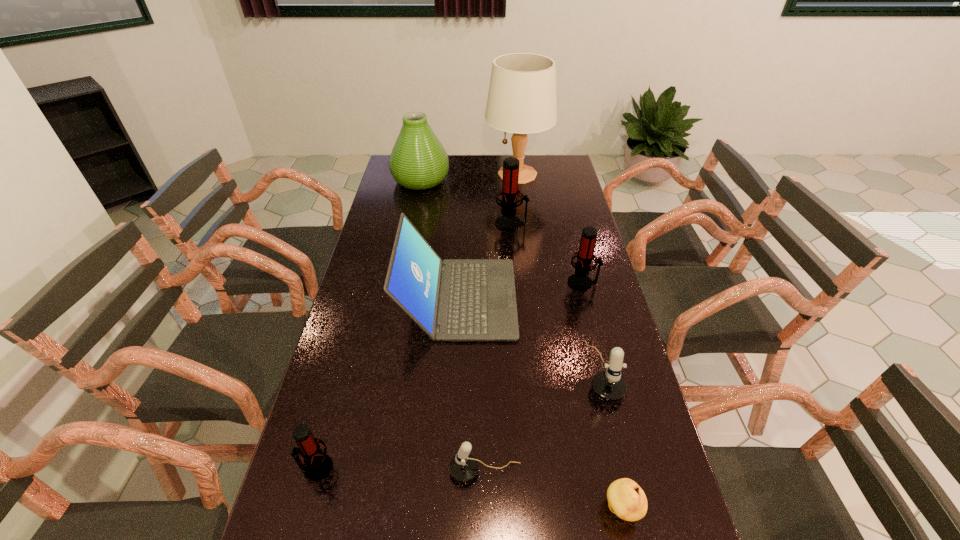
Identify the location of pear at the right edge. click(626, 499).

Find the location of `object that is positioned at the far left corner`. object that is positioned at the far left corner is located at coordinates (418, 161).

What are the coordinates of `object that is positioned at the far right corner` in the screenshot? It's located at (522, 99).

Locate an element on the screen. This screenshot has height=540, width=960. free space at the far edge of the desktop is located at coordinates (503, 159).

Image resolution: width=960 pixels, height=540 pixels. In the image, there is a desktop. Find the location of `vacant space at the left edge`. vacant space at the left edge is located at coordinates (376, 283).

Find the location of `vacant area at the right edge`. vacant area at the right edge is located at coordinates (630, 470).

Where is `free spot at the far right corner of the desktop`? This screenshot has width=960, height=540. free spot at the far right corner of the desktop is located at coordinates (558, 158).

The height and width of the screenshot is (540, 960). What are the coordinates of `empty space between the farther white microphone and the leftmost red microphone` in the screenshot? It's located at (459, 420).

I want to click on free space between the shortest object and the beige table lamp, so click(569, 342).

Identify the location of empty space between the pear and the left white microphone. (554, 490).